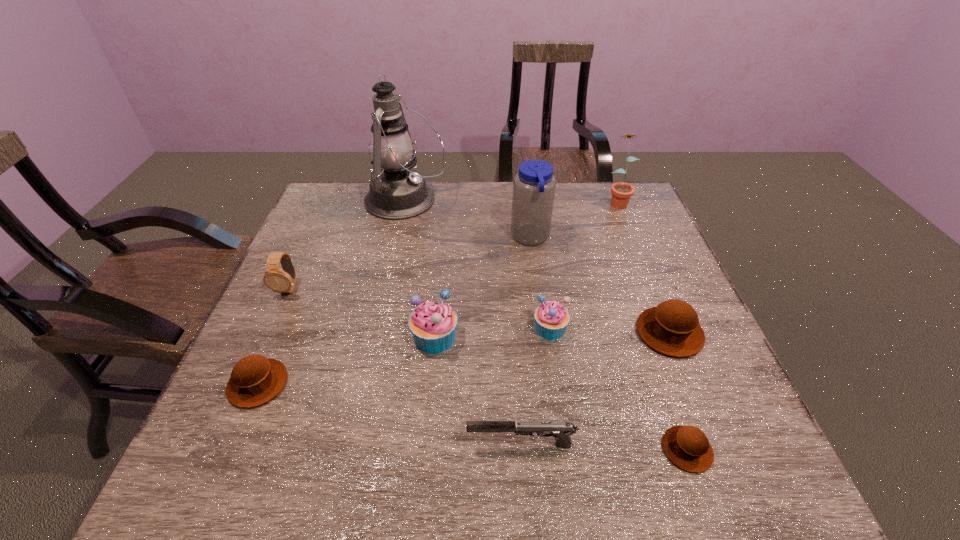
At what (x,y) coordinates should I click in order to perform the action: click on gray gun. Please return your answer as a coordinate pair (x, y). Looking at the image, I should click on (561, 431).

Find the location of a particular element. the leftmost brown muffin is located at coordinates (255, 380).

The image size is (960, 540). I want to click on the fourth farthest muffin, so click(255, 380).

Locate an element on the screen. the shortest object is located at coordinates (x=687, y=447).

Find the location of a particular element. Image resolution: width=960 pixels, height=540 pixels. the nearest brown muffin is located at coordinates (687, 447).

Identify the location of vacant space located 0.120m on the left of the tallest object. The image size is (960, 540). (327, 201).

This screenshot has width=960, height=540. Find the location of `vacant space situated 0.130m on the flower of the sunflower`. vacant space situated 0.130m on the flower of the sunflower is located at coordinates (632, 237).

At what (x,y) coordinates should I click in order to perform the action: click on vacant space situated 0.350m with a carrying loop on the side of the water bottle. Please return your answer as a coordinate pair (x, y). Looking at the image, I should click on (390, 238).

Find the location of a particular element. The width and height of the screenshot is (960, 540). vacant space located with a carrying loop on the side of the water bottle is located at coordinates (x=431, y=238).

The width and height of the screenshot is (960, 540). I want to click on free space located with a carrying loop on the side of the water bottle, so click(435, 238).